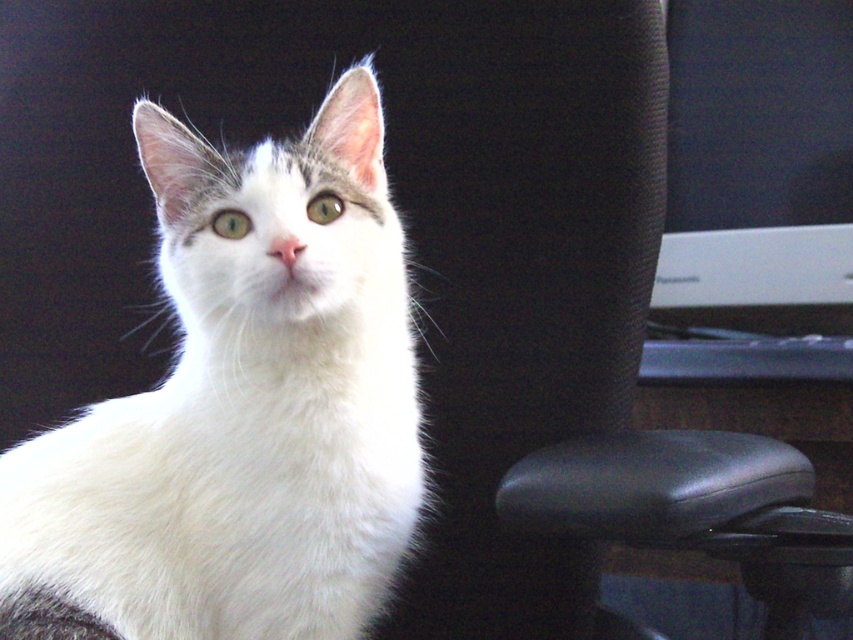
Looking at this image, you are a photographer setting up equipment in an office. You have a white fur cat at center and a white plastic monitor at right in your frame. You need to ensure there is at least 30 inches of space between them for lighting setup. Based on the scene description, is the current distance sufficient?

The white fur cat at center and the white plastic monitor at right are 30.25 inches apart, which is just enough to meet the 30 inches requirement for the lighting setup.

You are setting up a photo shoot and need to decide the camera angle. The white fur cat at center and the white plastic monitor at right are both in the frame. Based on their sizes, which object should you prioritize focusing on to ensure it fills the frame appropriately?

The white fur cat at center is larger in width than the white plastic monitor at right, so you should prioritize focusing on the white fur cat at center to ensure it fills the frame appropriately.

You are trying to decide if the white fur cat at center can comfortably sit on the white plastic monitor at right. Based on their sizes, what do you think?

The white fur cat at center has a smaller size compared to the white plastic monitor at right, so it should be able to comfortably sit on the white plastic monitor at right.